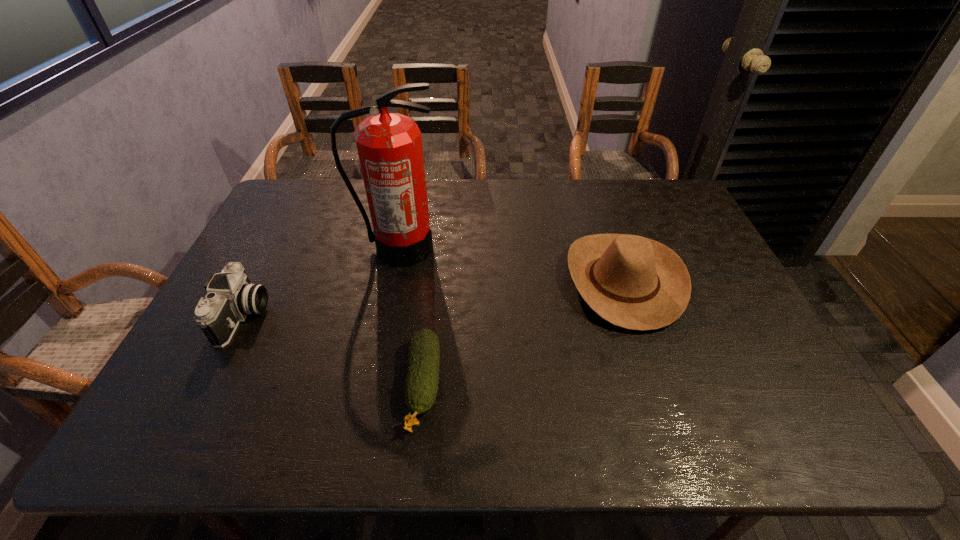
Locate an element on the screen. the tallest object is located at coordinates click(x=389, y=145).

The width and height of the screenshot is (960, 540). In order to click on cowboy hat in this screenshot , I will do `click(633, 282)`.

Where is `the leftmost object`? Image resolution: width=960 pixels, height=540 pixels. the leftmost object is located at coordinates pyautogui.click(x=231, y=296).

I want to click on the shortest object, so click(422, 379).

At what (x,y) coordinates should I click in order to perform the action: click on vacant space located 0.310m on the front side of the fire extinguisher. Please return your answer as a coordinate pair (x, y). The width and height of the screenshot is (960, 540). Looking at the image, I should click on (377, 352).

This screenshot has height=540, width=960. What are the coordinates of `blank space located on the front-facing side of the cowboy hat` in the screenshot? It's located at (450, 281).

Identify the location of vacant space located on the front-facing side of the cowboy hat. Image resolution: width=960 pixels, height=540 pixels. pyautogui.click(x=541, y=281).

I want to click on vacant area situated 0.390m on the front-facing side of the cowboy hat, so click(429, 281).

The image size is (960, 540). Find the location of `vacant region located on the front of the camera`. vacant region located on the front of the camera is located at coordinates point(185,429).

The image size is (960, 540). What are the coordinates of `object positioned at the near edge` in the screenshot? It's located at (422, 379).